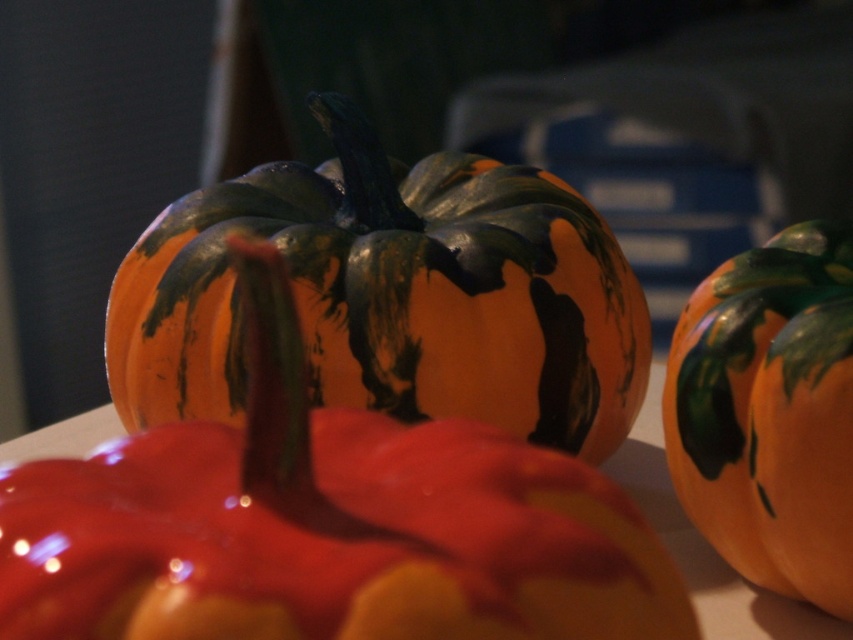
Question: Does matte orange pumpkin at center appear under orange matte pumpkin at right?

Choices:
 (A) yes
 (B) no

Answer: (B)

Question: Which of the following is the farthest from the observer?

Choices:
 (A) orange matte pumpkin at center
 (B) orange matte pumpkin at right

Answer: (B)

Question: Which point is closer to the camera taking this photo?

Choices:
 (A) (770, 582)
 (B) (372, 577)
 (C) (529, 324)

Answer: (B)

Question: Which object is the closest to the orange matte pumpkin at center?

Choices:
 (A) matte orange pumpkin at center
 (B) orange matte pumpkin at right

Answer: (B)

Question: Does orange matte pumpkin at center come behind matte orange pumpkin at center?

Choices:
 (A) no
 (B) yes

Answer: (A)

Question: Is matte orange pumpkin at center wider than orange matte pumpkin at right?

Choices:
 (A) no
 (B) yes

Answer: (B)